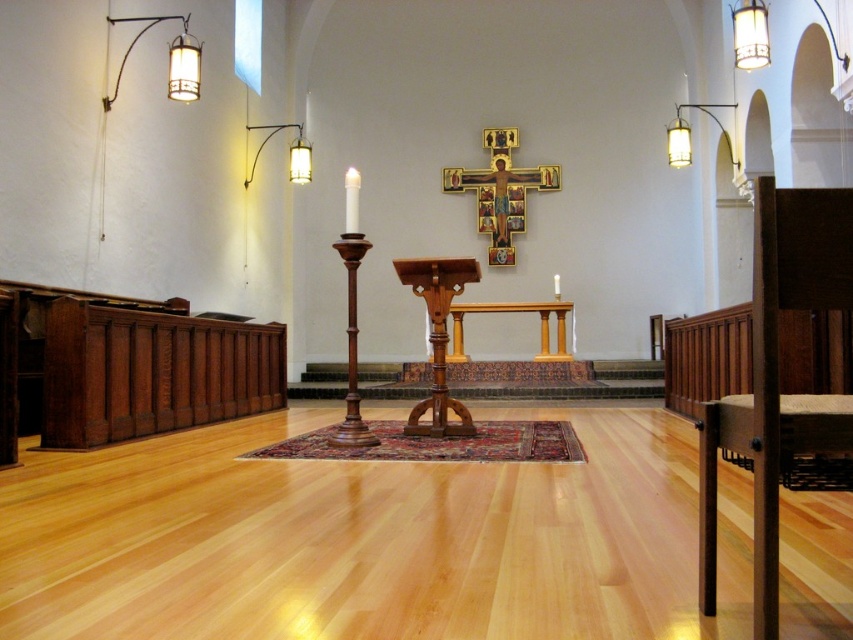
Is wooden pulpit at center shorter than metallic wall-mounted light fixture at upper left?

No.

Does point (430, 269) come behind point (183, 16)?

That is False.

Locate an element on the screen. The image size is (853, 640). wooden pulpit at center is located at coordinates (437, 337).

Where is `wooden pulpit at center`? The width and height of the screenshot is (853, 640). wooden pulpit at center is located at coordinates (437, 337).

Does metallic wall-mounted light fixture at upper left have a lesser width compared to wooden altar at center?

Yes.

Who is more distant from viewer, (189, 13) or (540, 333)?

The point (540, 333) is behind.

Does point (194, 97) come closer to viewer compared to point (461, 340)?

Yes, it is in front of point (461, 340).

Where is `metallic wall-mounted light fixture at upper left`? This screenshot has width=853, height=640. metallic wall-mounted light fixture at upper left is located at coordinates (167, 60).

Based on the photo, does wooden pulpit at center come behind metallic wall sconce at upper left?

No, wooden pulpit at center is closer to the viewer.

Where is `wooden pulpit at center`? The height and width of the screenshot is (640, 853). wooden pulpit at center is located at coordinates (437, 337).